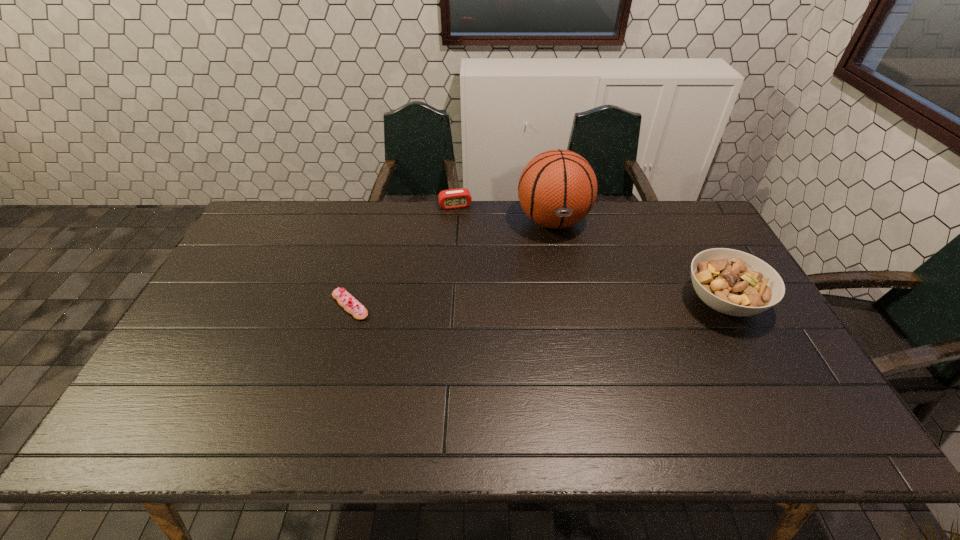
Identify the location of vacant area that lies between the rightmost object and the second object from right to left. This screenshot has height=540, width=960. (637, 261).

Find the location of a particular element. empty space between the alarm clock and the leftmost object is located at coordinates (402, 255).

Image resolution: width=960 pixels, height=540 pixels. I want to click on empty location between the eclair and the third object from left to right, so click(451, 264).

Choose which object is the third nearest neighbor to the second shortest object. Please provide its 2D coordinates. Your answer should be formatted as a tuple, i.e. [(x, y)], where the tuple contains the x and y coordinates of a point satisfying the conditions above.

[(732, 282)]

Image resolution: width=960 pixels, height=540 pixels. What are the coordinates of `object that is the closest one to the basketball` in the screenshot? It's located at (454, 198).

At what (x,y) coordinates should I click in order to perform the action: click on free region that satisfies the following two spatial constraints: 1. on the back side of the third tallest object; 2. on the right side of the shortest object. Please return your answer as a coordinate pair (x, y). Looking at the image, I should click on (378, 205).

Locate an element on the screen. The width and height of the screenshot is (960, 540). vacant space that satisfies the following two spatial constraints: 1. on the back side of the third object from left to right; 2. on the left side of the shortest object is located at coordinates (374, 221).